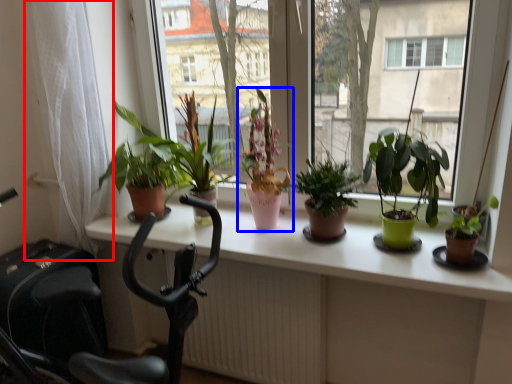
Question: Which object is further to the camera taking this photo, curtain (highlighted by a red box) or houseplant (highlighted by a blue box)?

Choices:
 (A) curtain
 (B) houseplant

Answer: (B)